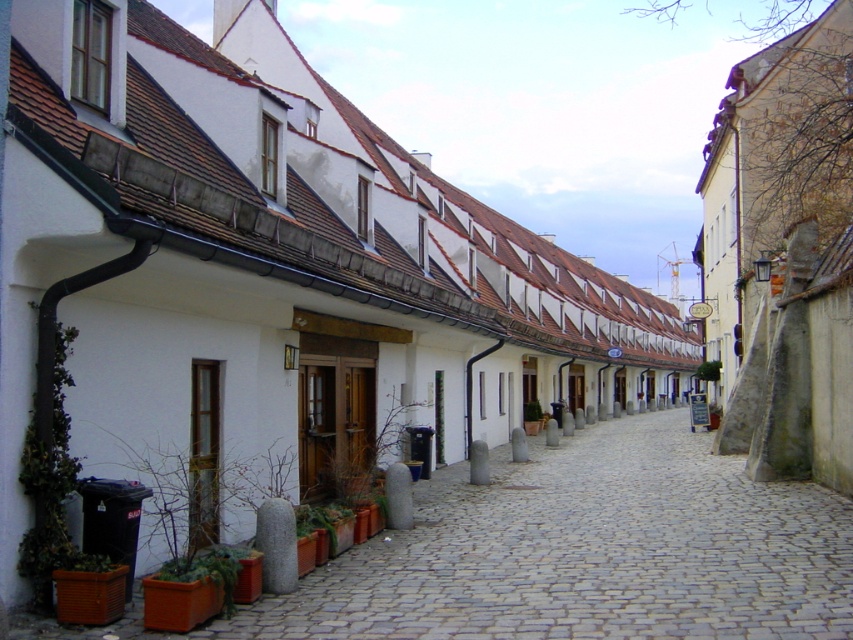
In the scene shown: You are standing on the smooth stone path at center and want to reach the green matte plant at center. Which direction should you move to get closer to the plant?

Since the smooth stone path at center is closer to the viewer than the green matte plant at center, you should move forward towards the plant to get closer to it.

You are a gardener who needs to determine which plant is shorter between the green matte plant at center and the green leafy plant at center. Can you identify the shorter one?

The green matte plant at center is not as tall as the green leafy plant at center, so the green matte plant at center is shorter.